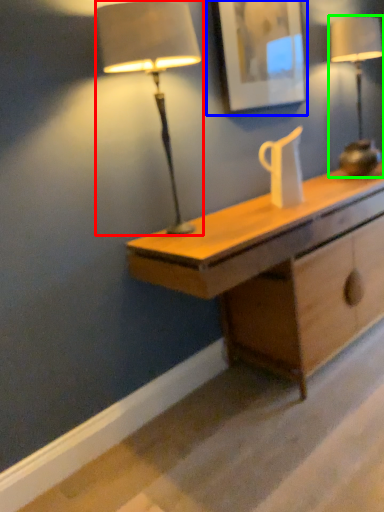
Question: Based on their relative distances, which object is farther from lamp (highlighted by a red box)? Choose from picture frame (highlighted by a blue box) and lamp (highlighted by a green box).

Choices:
 (A) picture frame
 (B) lamp

Answer: (B)